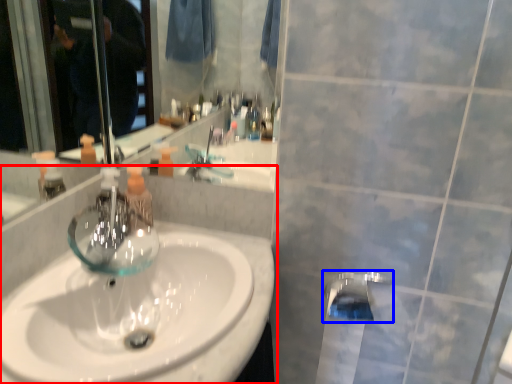
Question: Which of the following is the farthest to the observer, sink (highlighted by a red box) or tap (highlighted by a blue box)?

Choices:
 (A) sink
 (B) tap

Answer: (B)